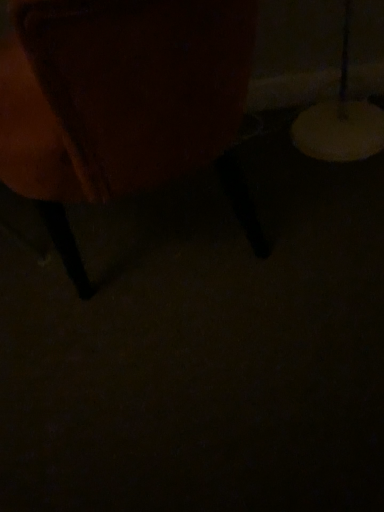
The image size is (384, 512). Describe the element at coordinates (138, 94) in the screenshot. I see `wooden chair at center` at that location.

This screenshot has width=384, height=512. What are the coordinates of `wooden chair at center` in the screenshot? It's located at (138, 94).

Locate an element on the screen. wooden chair at center is located at coordinates (138, 94).